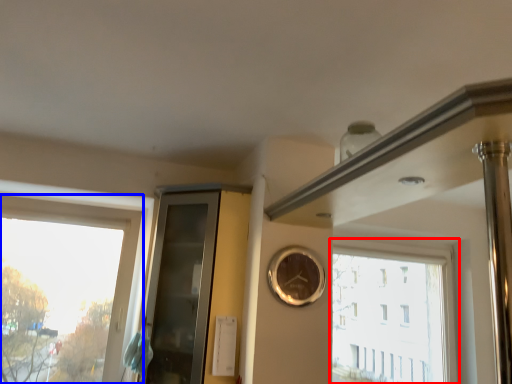
Question: Which object appears farthest to the camera in this image, window (highlighted by a red box) or window (highlighted by a blue box)?

Choices:
 (A) window
 (B) window

Answer: (A)